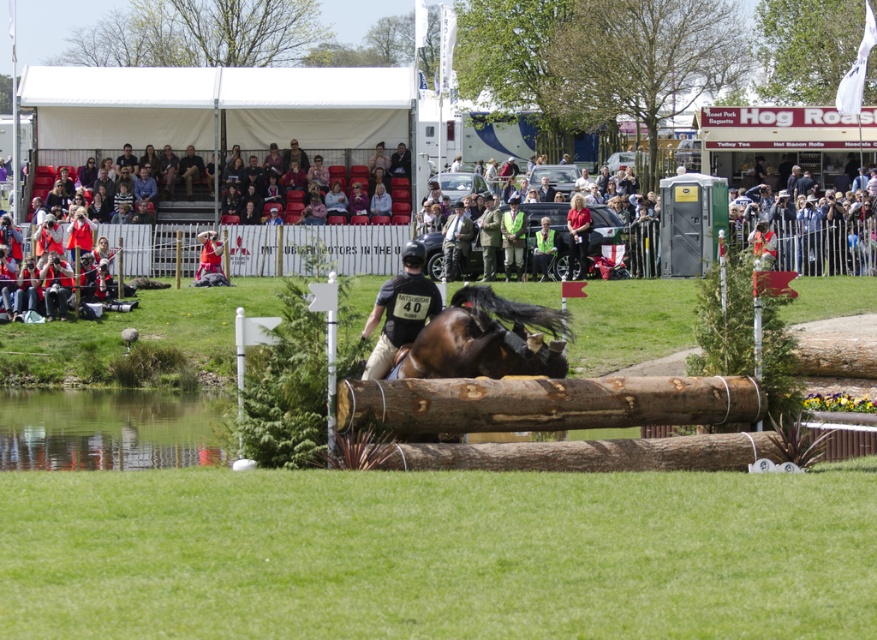
You are a photographer at the show jumping competition. You want to capture a photo where the brown glossy horse at center is clearly visible above the black matte shirt at center. Based on their heights, is this possible?

The brown glossy horse at center has a lesser height compared to black matte shirt at center, so the horse is shorter than the shirt. Therefore, it is not possible for the horse to be visible above the shirt in the photo.

Based on the photo, you are a judge at the show jumping competition. You need to determine if the natural wood log at center is wider than the black matte shirt at center. What is your ruling?

The natural wood log at center might be wider than the black matte shirt at center, so the judge should measure both to confirm the exact width difference.